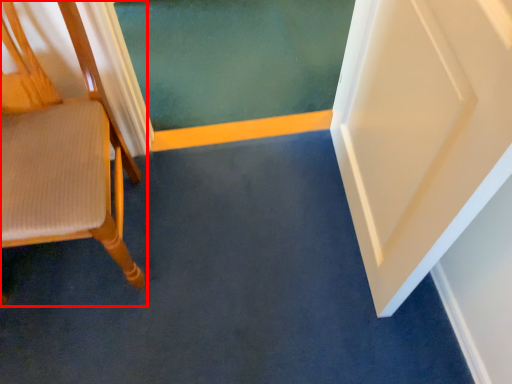
Question: Considering the relative positions of chair (annotated by the red box) and strip in the image provided, where is chair (annotated by the red box) located with respect to the staircase?

Choices:
 (A) right
 (B) left

Answer: (B)